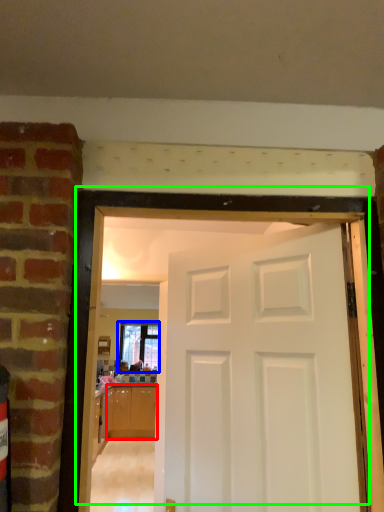
Question: Based on their relative distances, which object is nearer to cabinetry (highlighted by a red box)? Choose from window (highlighted by a blue box) and door (highlighted by a green box).

Choices:
 (A) window
 (B) door

Answer: (A)